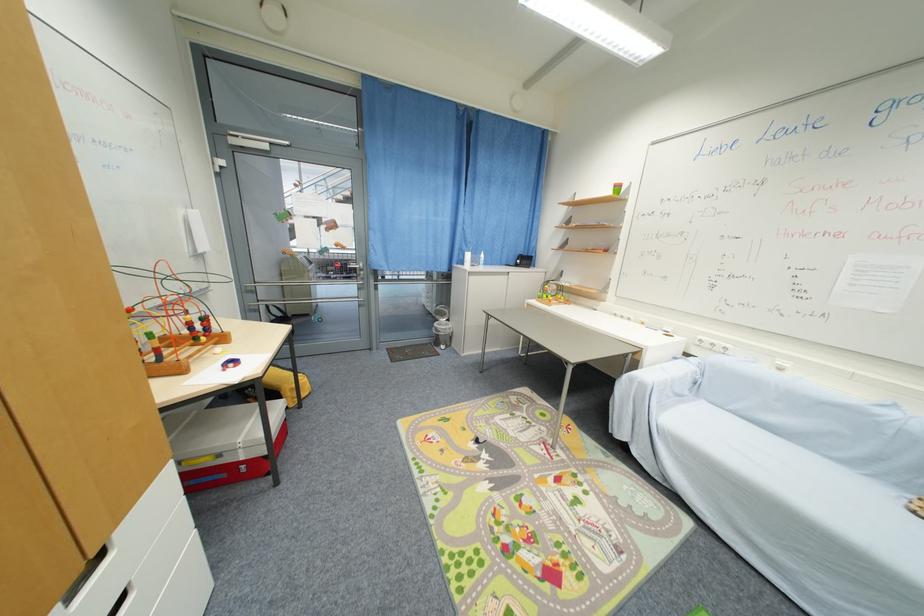
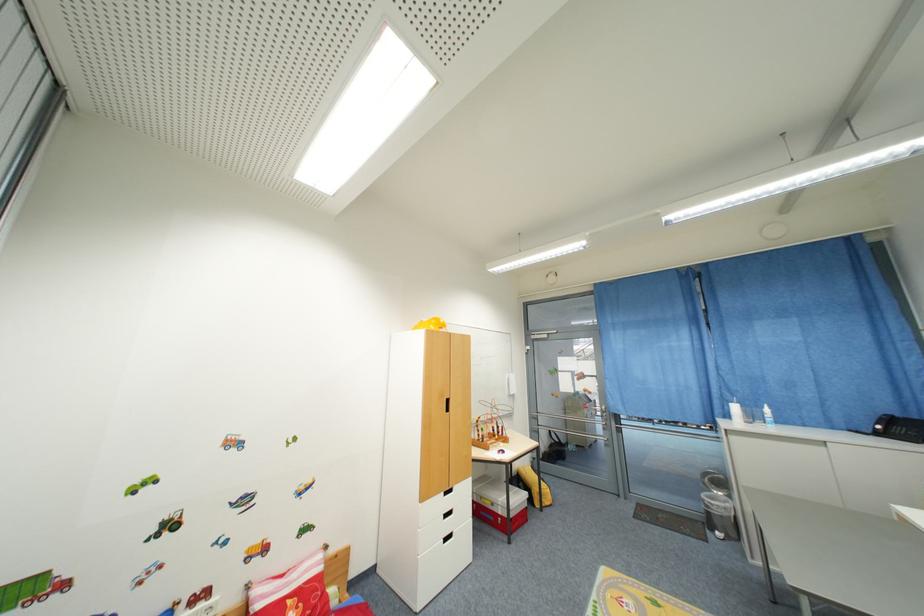
Locate, in the second image, the point that corresponds to pixel 228 477 in the first image.

(497, 521)